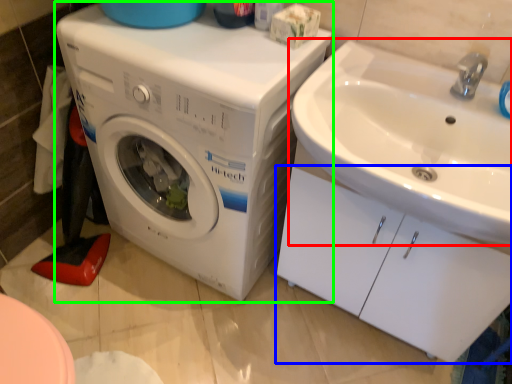
Question: Which object is positioned farthest from sink (highlighted by a red box)? Select from drawer (highlighted by a blue box) and washing machine (highlighted by a green box).

Choices:
 (A) drawer
 (B) washing machine

Answer: (B)